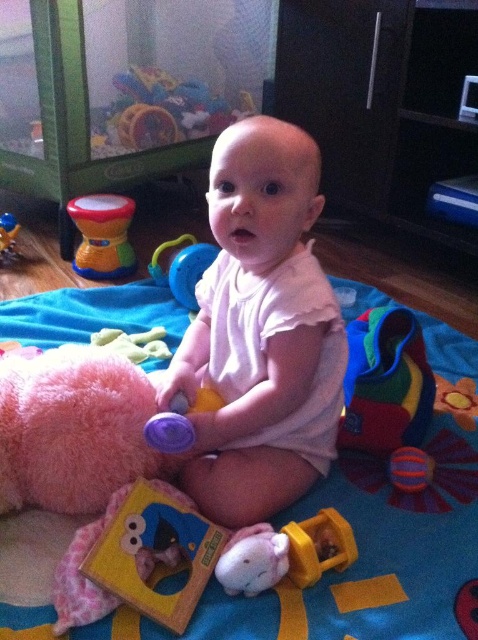
Question: Which of the following is the closest to the observer?

Choices:
 (A) tap(175, 268)
 (B) tap(219, 564)

Answer: (B)

Question: Does white plush toy at center have a lesser width compared to yellow rubber teething ring at lower center?

Choices:
 (A) yes
 (B) no

Answer: (A)

Question: Does rainbow plastic drum at center appear on the right side of white plush toy at center?

Choices:
 (A) yes
 (B) no

Answer: (B)

Question: Which object is the farthest from the white plush toy at center?

Choices:
 (A) white matte baby at center
 (B) blue rubber rattle at center
 (C) rubberized plastic rattle at lower left

Answer: (C)

Question: Which object appears closest to the camera in this image?

Choices:
 (A) multicolored fabric toy at center
 (B) white matte baby at center
 (C) rainbow plastic drum at center

Answer: (B)

Question: Can you confirm if multicolored fabric toy at center is smaller than rainbow plastic drum at center?

Choices:
 (A) no
 (B) yes

Answer: (A)